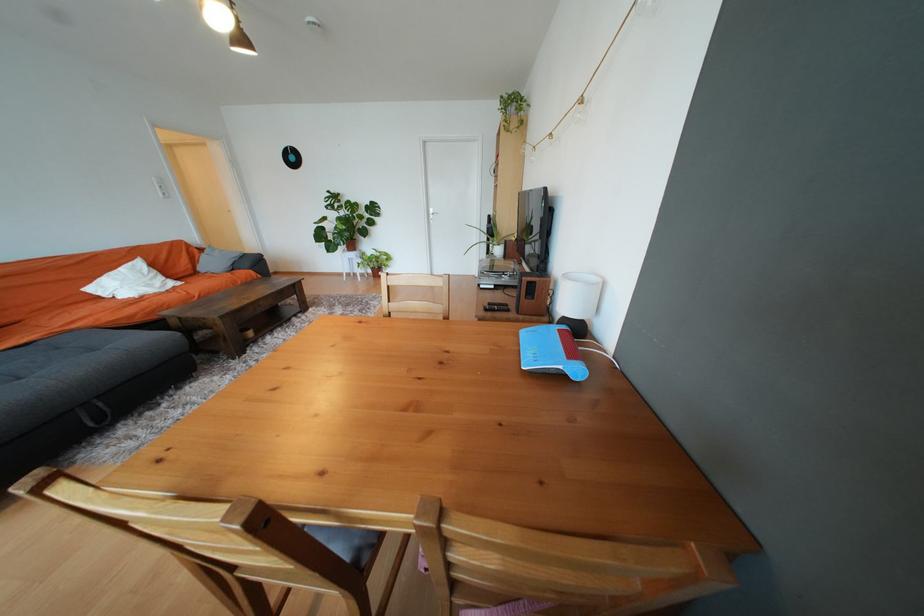
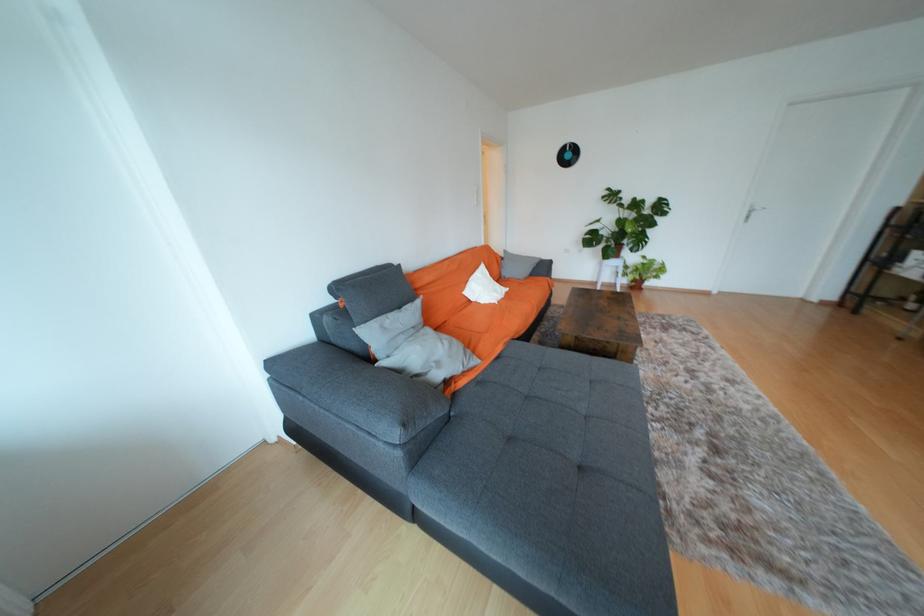
Find the pixel in the second image that matches (30,342) in the first image.

(504, 353)